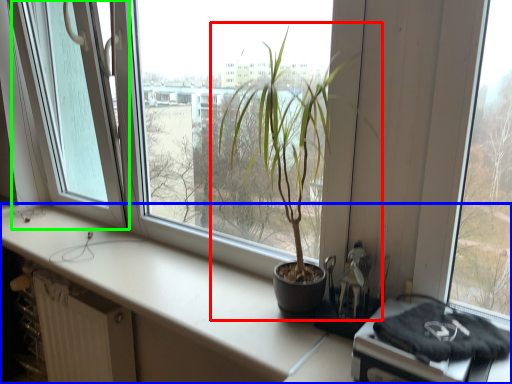
Question: Estimate the real-world distances between objects in this image. Which object is farther from houseplant (highlighted by a red box), counter top (highlighted by a blue box) or glass door (highlighted by a green box)?

Choices:
 (A) counter top
 (B) glass door

Answer: (B)